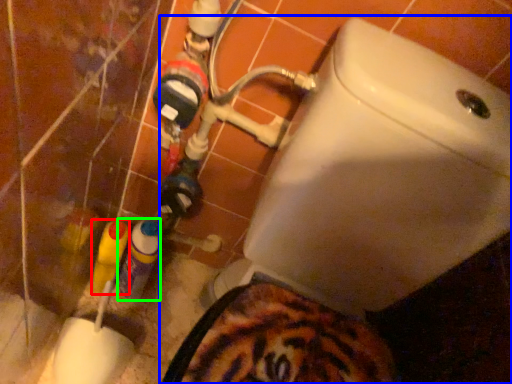
Question: Which object is the farthest from bottle (highlighted by a red box)? Choose among these: toilet (highlighted by a blue box) or bottle (highlighted by a green box).

Choices:
 (A) toilet
 (B) bottle

Answer: (A)